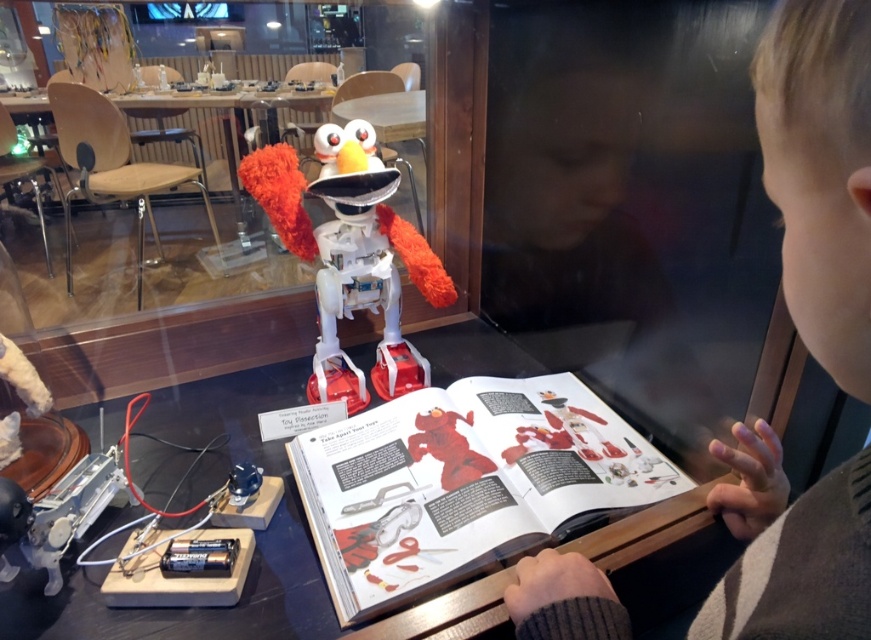
Does point (620, 500) lie in front of point (268, 621)?

No, (620, 500) is behind (268, 621).

Where is `matte red book at center`? matte red book at center is located at coordinates (464, 483).

Where is `matte red book at center`? matte red book at center is located at coordinates (464, 483).

You are a GUI agent. You are given a task and a screenshot of the screen. Output one action in this format:
    pyautogui.click(x=<x>, y=<y>)
    Task: Click on the black plastic table at center
    
    Given the screenshot: What is the action you would take?
    pyautogui.click(x=191, y=502)

Can you confirm if black plastic table at center is shorter than fuzzy white robot at center?

Indeed, black plastic table at center has a lesser height compared to fuzzy white robot at center.

Who is more forward, (110, 508) or (423, 248)?

Point (110, 508)

This screenshot has width=871, height=640. Find the location of `black plastic table at center`. black plastic table at center is located at coordinates [x=191, y=502].

Who is taller, blonde hair boy at upper right or matte red book at center?

blonde hair boy at upper right is taller.

I want to click on blonde hair boy at upper right, so click(820, 173).

Is point (856, 180) positioned before point (474, 561)?

That is True.

Locate an element on the screen. blonde hair boy at upper right is located at coordinates (820, 173).